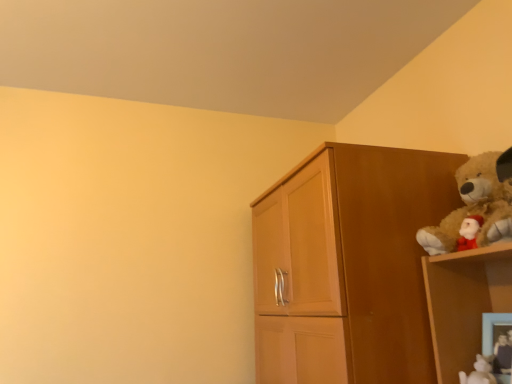
Question: Does fuzzy brown teddy bear at upper right have a larger size compared to wooden cupboard at right?

Choices:
 (A) yes
 (B) no

Answer: (B)

Question: Could you tell me if fuzzy brown teddy bear at upper right is facing wooden cupboard at right?

Choices:
 (A) yes
 (B) no

Answer: (B)

Question: From a real-world perspective, is fuzzy brown teddy bear at upper right positioned over wooden cupboard at right based on gravity?

Choices:
 (A) no
 (B) yes

Answer: (B)

Question: Does fuzzy brown teddy bear at upper right have a lesser height compared to wooden cupboard at right?

Choices:
 (A) yes
 (B) no

Answer: (A)

Question: From the image's perspective, is fuzzy brown teddy bear at upper right below wooden cupboard at right?

Choices:
 (A) no
 (B) yes

Answer: (A)

Question: Considering the relative sizes of fuzzy brown teddy bear at upper right and wooden cupboard at right in the image provided, is fuzzy brown teddy bear at upper right thinner than wooden cupboard at right?

Choices:
 (A) yes
 (B) no

Answer: (A)

Question: Could you tell me if wooden picture frame at lower right is facing wooden cupboard at right?

Choices:
 (A) yes
 (B) no

Answer: (B)

Question: Does wooden picture frame at lower right come behind wooden cupboard at right?

Choices:
 (A) no
 (B) yes

Answer: (A)

Question: From the image's perspective, does wooden picture frame at lower right appear lower than wooden cupboard at right?

Choices:
 (A) no
 (B) yes

Answer: (B)

Question: Is wooden picture frame at lower right taller than wooden cupboard at right?

Choices:
 (A) yes
 (B) no

Answer: (B)

Question: Considering the relative positions of wooden picture frame at lower right and wooden cupboard at right in the image provided, is wooden picture frame at lower right in front of wooden cupboard at right?

Choices:
 (A) yes
 (B) no

Answer: (A)

Question: Can you confirm if wooden picture frame at lower right is wider than wooden cupboard at right?

Choices:
 (A) yes
 (B) no

Answer: (B)

Question: Is velvety plush bear at upper right, the second toy in the left-to-right sequence, at the back of wooden cupboard at right?

Choices:
 (A) yes
 (B) no

Answer: (B)